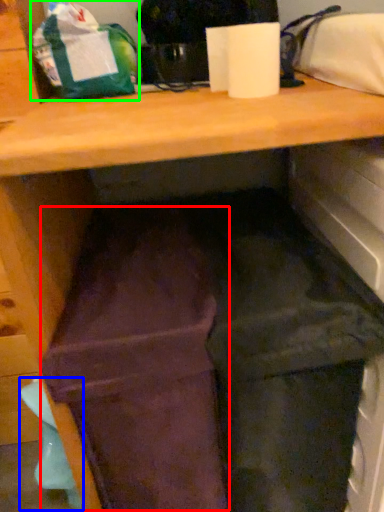
Question: Estimate the real-world distances between objects in this image. Which object is closer to wide (highlighted by a red box), waste (highlighted by a blue box) or bag (highlighted by a green box)?

Choices:
 (A) waste
 (B) bag

Answer: (A)